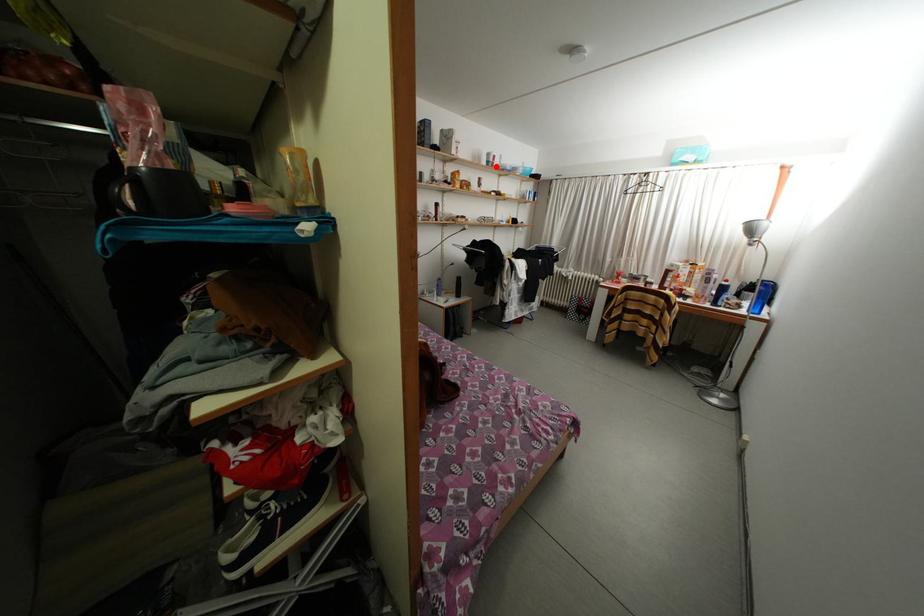
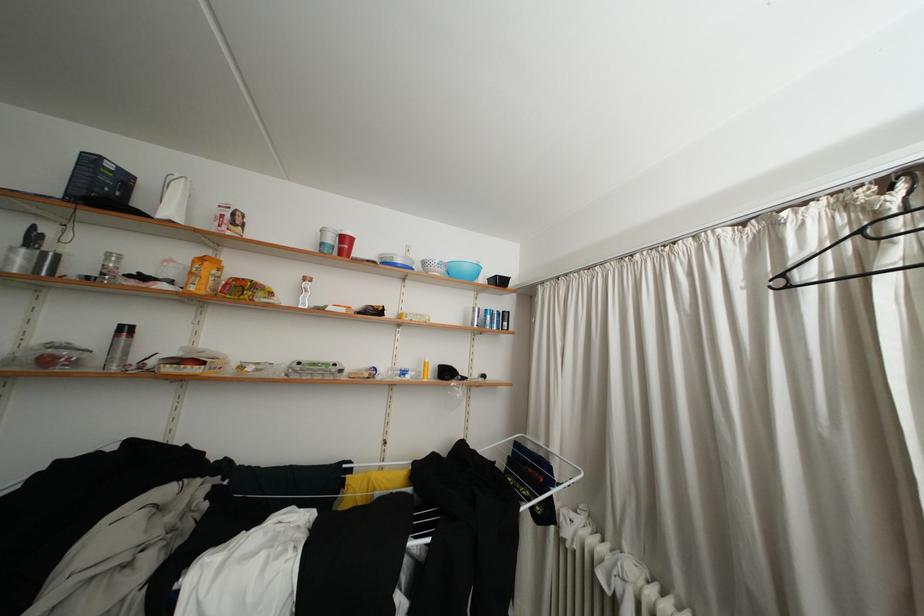
Locate, in the second image, the point that corresponds to the highlighted location in the first image.

(330, 249)